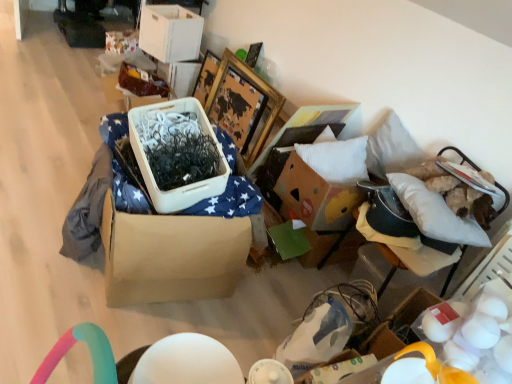
Question: Considering the positions of point (216, 120) and point (150, 39), is point (216, 120) closer or farther from the camera than point (150, 39)?

Choices:
 (A) farther
 (B) closer

Answer: (B)

Question: From a real-world perspective, is wooden picture frame at upper center above or below white cardboard storage box at upper center, arranged as the 1th storage box when viewed from the top?

Choices:
 (A) above
 (B) below

Answer: (B)

Question: Considering the real-world distances, which object is farthest from the brown cardboard box at center?

Choices:
 (A) wooden picture frame at upper center
 (B) white matte eggs at lower right
 (C) white soft pillow at upper right
 (D) white cardboard storage box at upper center, arranged as the 1th storage box when viewed from the top
 (E) white fabric cushion at right

Answer: (D)

Question: Which object is the closest to the wooden picture frame at upper center?

Choices:
 (A) white matte eggs at lower right
 (B) white fabric cushion at right
 (C) matte brown storage box at upper left, the 1th storage box positioned from the bottom
 (D) white soft pillow at upper right
 (E) white cardboard storage box at upper center, which ranks as the second storage box in bottom-to-top order

Answer: (C)